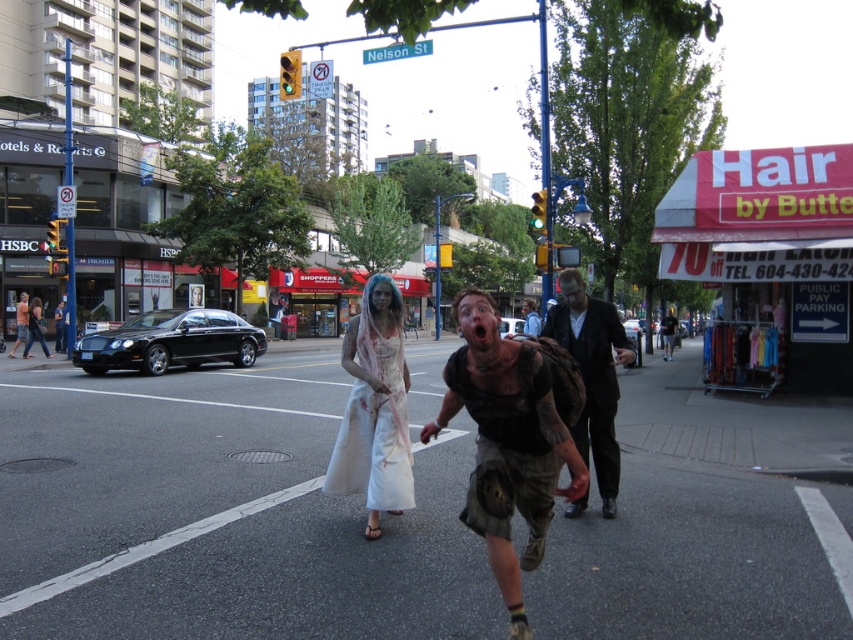
Question: Which object is the closest to the dark brown leather jacket at center?

Choices:
 (A) black matte tank top at center
 (B) white cotton dress at center

Answer: (A)

Question: Based on their relative distances, which object is nearer to the dark brown leather jacket at center?

Choices:
 (A) white cotton dress at center
 (B) black matte tank top at center

Answer: (B)

Question: Among these points, which one is nearest to the camera?

Choices:
 (A) (397, 408)
 (B) (570, 497)

Answer: (B)

Question: Can you confirm if white cotton dress at center is positioned above dark brown leather jacket at center?

Choices:
 (A) no
 (B) yes

Answer: (B)

Question: Does black matte tank top at center have a larger size compared to white cotton dress at center?

Choices:
 (A) no
 (B) yes

Answer: (A)

Question: Does black matte tank top at center have a larger size compared to dark brown leather jacket at center?

Choices:
 (A) no
 (B) yes

Answer: (B)